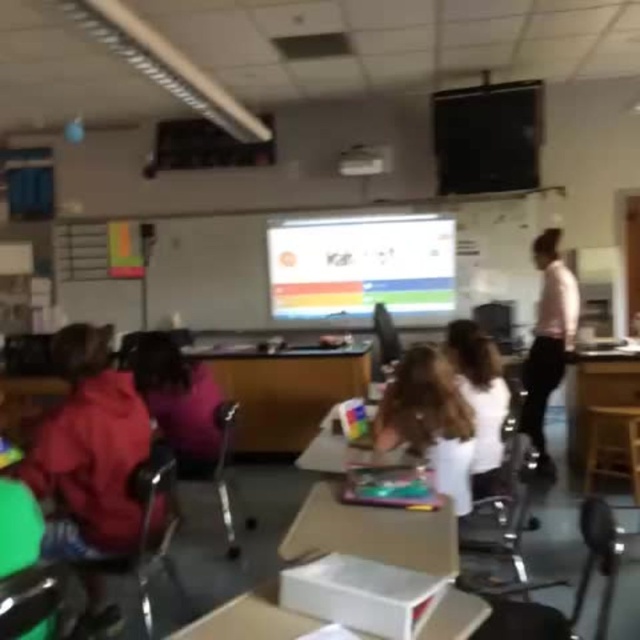
Question: Among these objects, which one is nearest to the camera?

Choices:
 (A) wooden stool at lower right
 (B) pink fabric shirt at right
 (C) white fabric shirt at center

Answer: (C)

Question: Which of the following is the farthest from the observer?

Choices:
 (A) (602, 406)
 (B) (312, 349)
 (C) (557, 284)
 (D) (444, 355)

Answer: (B)

Question: Is the position of wooden desk at center more distant than that of wooden stool at lower right?

Choices:
 (A) no
 (B) yes

Answer: (B)

Question: Does wooden desk at center come in front of pink fabric shirt at right?

Choices:
 (A) no
 (B) yes

Answer: (A)

Question: Can you confirm if white fabric shirt at center is bigger than pink fabric shirt at right?

Choices:
 (A) no
 (B) yes

Answer: (A)

Question: Which object is the farthest from the pink fabric shirt at right?

Choices:
 (A) wooden desk at center
 (B) white fabric shirt at center
 (C) wooden stool at lower right

Answer: (B)